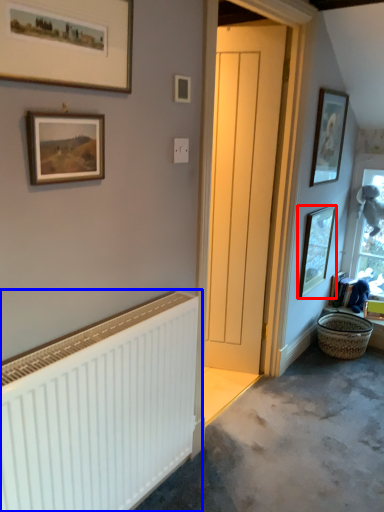
Question: Which object appears closest to the camera in this image, picture frame (highlighted by a red box) or radiator (highlighted by a blue box)?

Choices:
 (A) picture frame
 (B) radiator

Answer: (B)